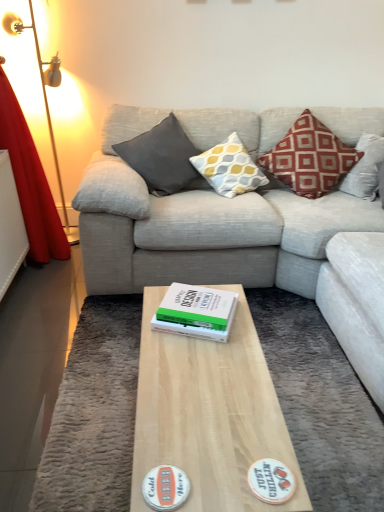
Find the location of a particular element. This screenshot has height=512, width=384. free spot to the right of matte white coaster at lower center, which ranks as the 2th sticker in right-to-left order is located at coordinates (228, 464).